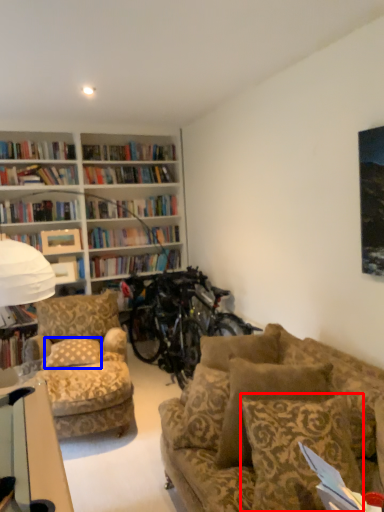
Question: Which point is closer to the camera, pillow (highlighted by a red box) or pillow (highlighted by a blue box)?

Choices:
 (A) pillow
 (B) pillow

Answer: (A)